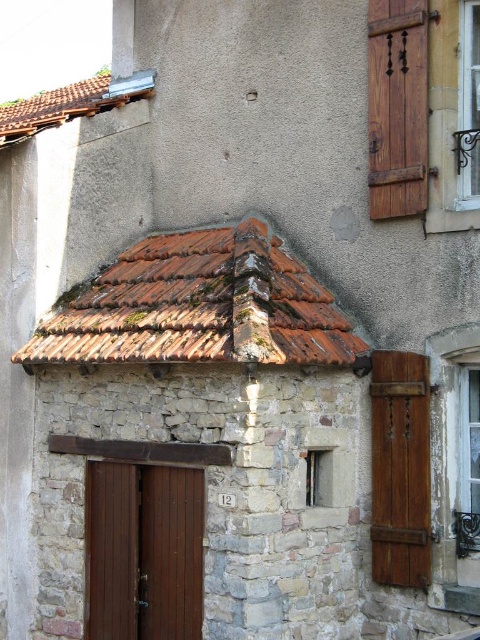
The height and width of the screenshot is (640, 480). Describe the element at coordinates (199, 307) in the screenshot. I see `rusty clay tiles at upper center` at that location.

Is point (257, 257) farther from camera compared to point (402, 481)?

Yes, it is behind point (402, 481).

Which is in front, point (206, 337) or point (417, 472)?

Point (206, 337) is more forward.

This screenshot has height=640, width=480. In order to click on rusty clay tiles at upper center in this screenshot , I will do `click(199, 307)`.

Can you confirm if rusty clay tiles at upper center is smaller than wooden shutter at upper right?

No, rusty clay tiles at upper center is not smaller than wooden shutter at upper right.

Is point (83, 326) closer to viewer compared to point (468, 35)?

That is False.

Image resolution: width=480 pixels, height=640 pixels. I want to click on rusty clay tiles at upper center, so click(199, 307).

Does wooden textured shutter at right have a lesser height compared to wooden shutter at upper right?

In fact, wooden textured shutter at right may be taller than wooden shutter at upper right.

Does wooden textured shutter at right appear on the right side of wooden shutter at upper right?

Incorrect, wooden textured shutter at right is not on the right side of wooden shutter at upper right.

Between point (371, 451) and point (463, 33), which one is positioned in front?

Point (463, 33) is more forward.

In order to click on wooden textured shutter at right in this screenshot , I will do `click(399, 468)`.